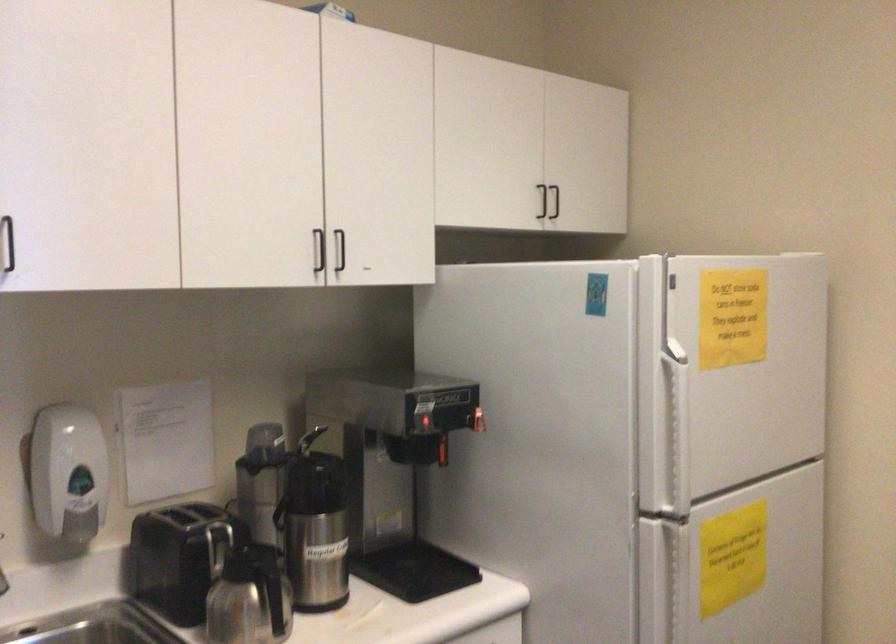
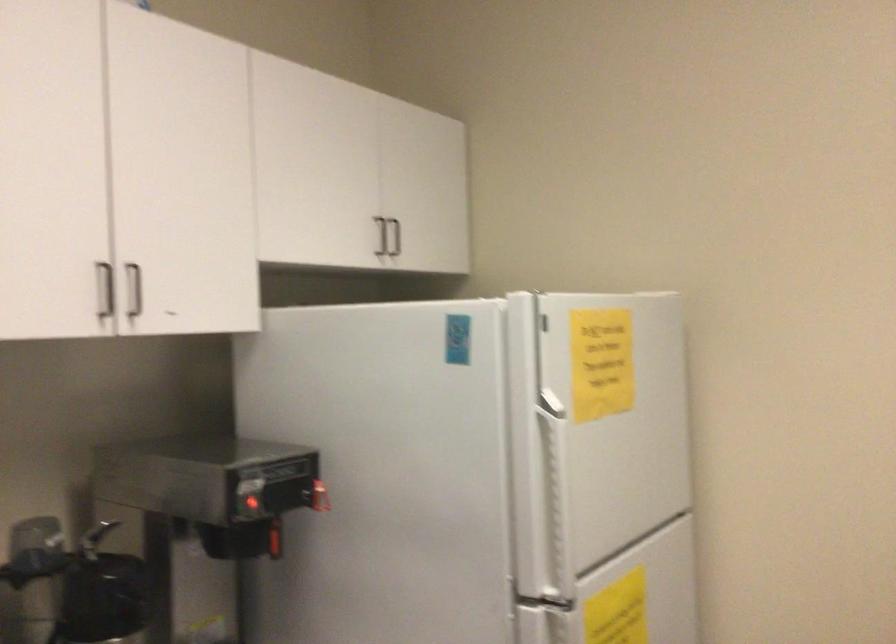
Where in the second image is the point corresponding to (x=673, y=543) from the first image?

(558, 627)